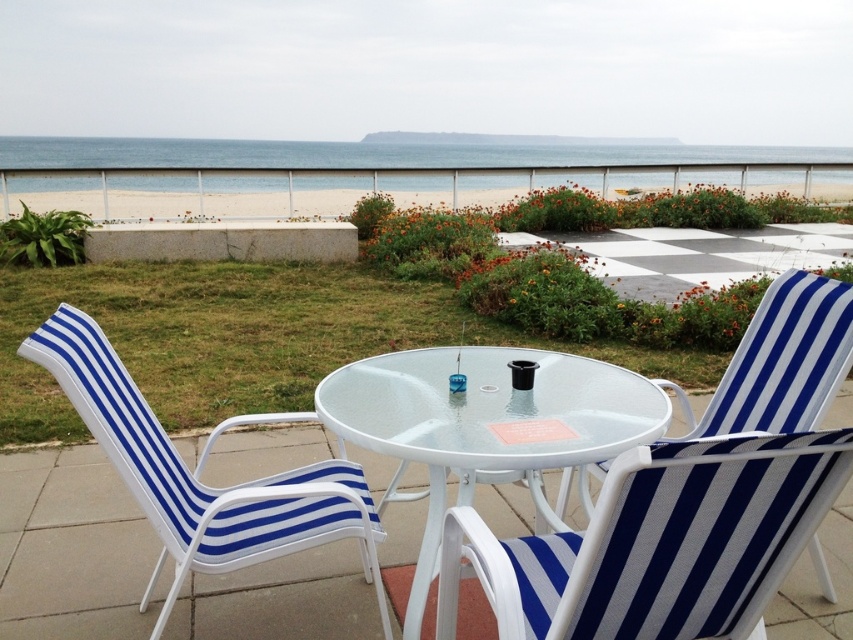
You are standing at the edge of the garden looking towards the beach. There are two points marked in the image. The first point is at coordinates point (440, 387) and the second is at point (45, 342). Which point is closer to the beach?

Point (45, 342) is closer to the beach because it is in front of point (440, 387), which is behind it.

You are planning to place a large potted plant between the blue striped fabric beach chair at left and the blue striped fabric chair at center. Based on their widths, which chair should the plant be closer to?

The blue striped fabric beach chair at left might be wider than blue striped fabric chair at center, so the plant should be closer to the blue striped fabric beach chair at left to accommodate its width.